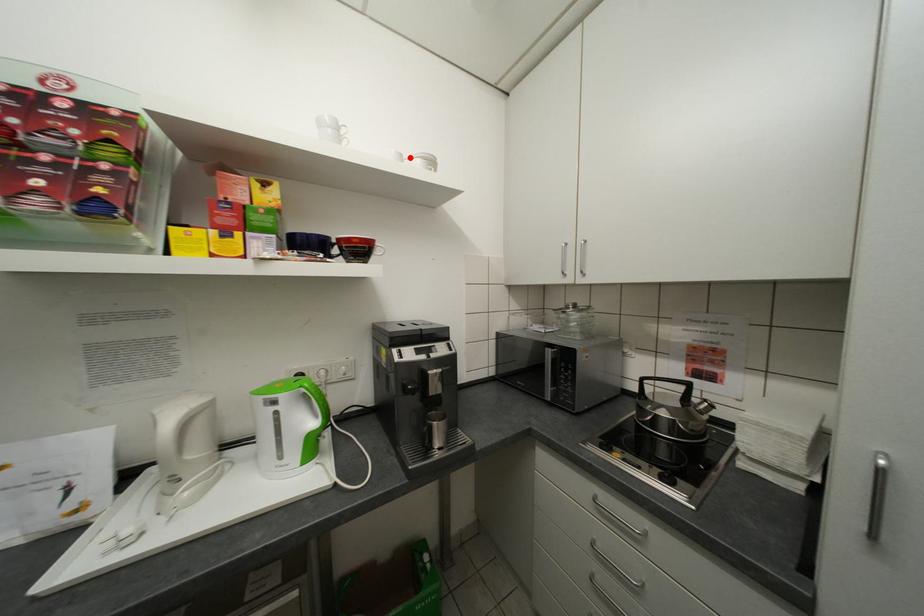
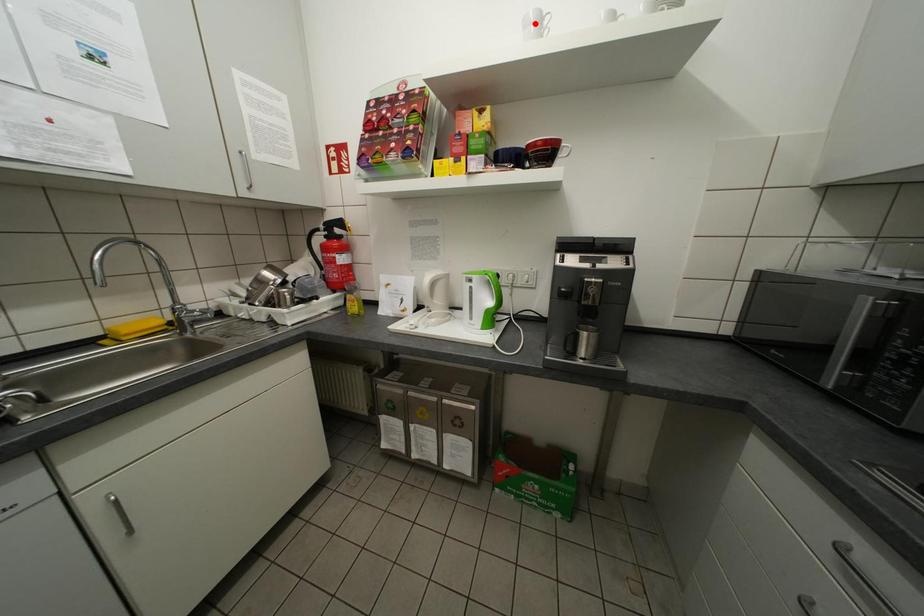
I am providing you with two images of the same scene from different viewpoints. A red point is marked on the first image and another point is marked on the second image. Are the points marked in image1 and image2 representing the same 3D position?

No